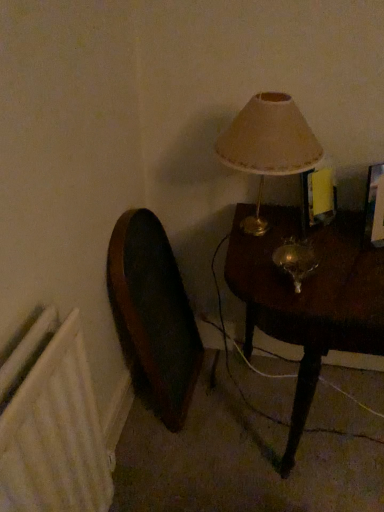
Question: Visually, is mahogany wood table at right positioned to the left or to the right of white textured radiator at lower left?

Choices:
 (A) right
 (B) left

Answer: (A)

Question: Is mahogany wood table at right bigger or smaller than white textured radiator at lower left?

Choices:
 (A) big
 (B) small

Answer: (A)

Question: Estimate the real-world distances between objects in this image. Which object is farther from the white textured radiator at lower left?

Choices:
 (A) wooden swivel chair at left
 (B) matte beige lampshade at upper right
 (C) mahogany wood table at right

Answer: (B)

Question: Based on their relative distances, which object is nearer to the white textured radiator at lower left?

Choices:
 (A) wooden swivel chair at left
 (B) mahogany wood table at right
 (C) matte beige lampshade at upper right

Answer: (A)